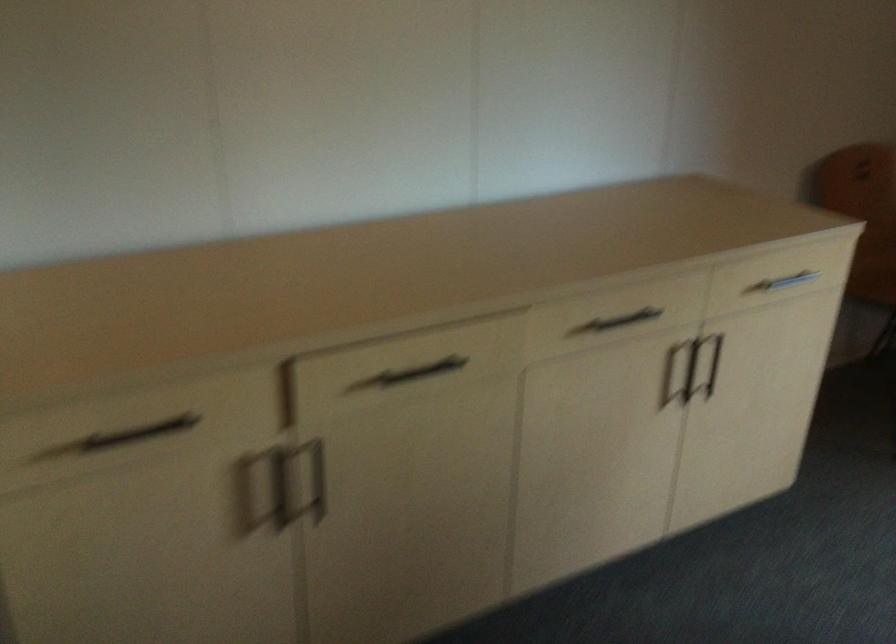
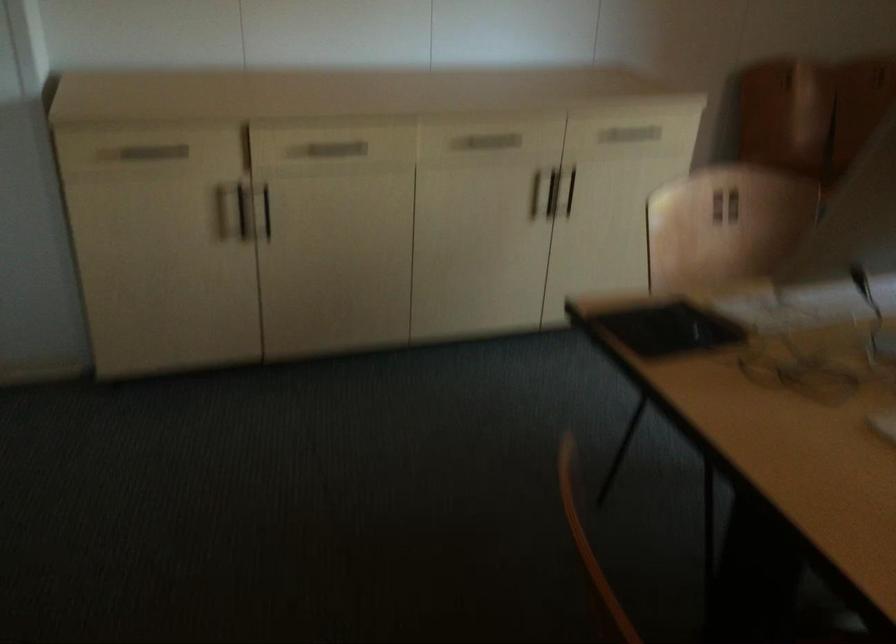
In the second image, find the point that corresponds to [288,485] in the first image.

(243, 211)